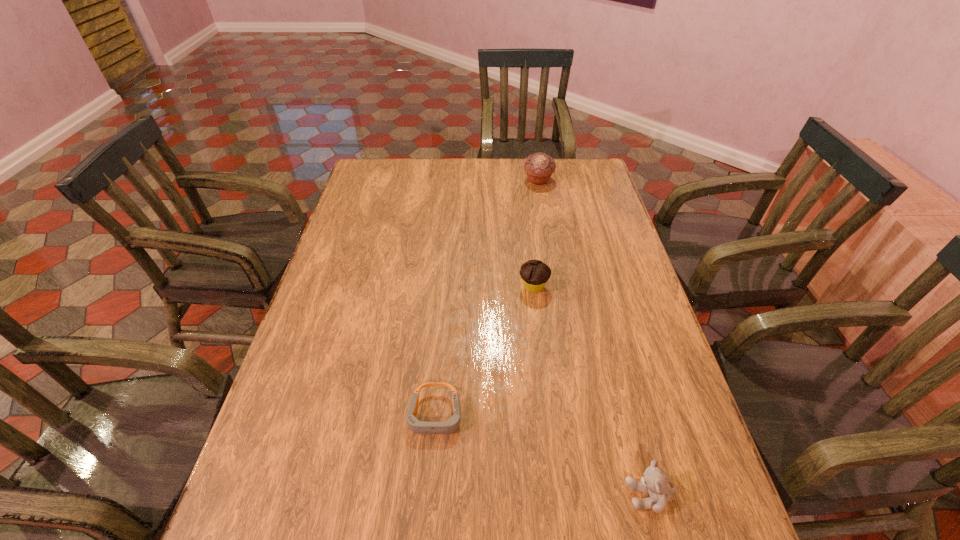
Where is `the farther muffin`? the farther muffin is located at coordinates (539, 167).

Locate an element on the screen. The image size is (960, 540). the taller muffin is located at coordinates (539, 167).

I want to click on the rightmost object, so click(x=654, y=482).

The height and width of the screenshot is (540, 960). What are the coordinates of `the nearest object` in the screenshot? It's located at (654, 482).

Image resolution: width=960 pixels, height=540 pixels. Identify the location of the third nearest object. (534, 273).

Image resolution: width=960 pixels, height=540 pixels. In order to click on the shorter muffin in this screenshot , I will do `click(534, 273)`.

The image size is (960, 540). In order to click on the leftmost object in this screenshot , I will do `click(451, 425)`.

This screenshot has height=540, width=960. Find the location of `the second nearest object`. the second nearest object is located at coordinates (451, 425).

Locate an element on the screen. The image size is (960, 540). free space located on the front of the farther muffin is located at coordinates (544, 209).

Locate an element on the screen. The height and width of the screenshot is (540, 960). free point located 0.180m on the face of the nearest object is located at coordinates (534, 495).